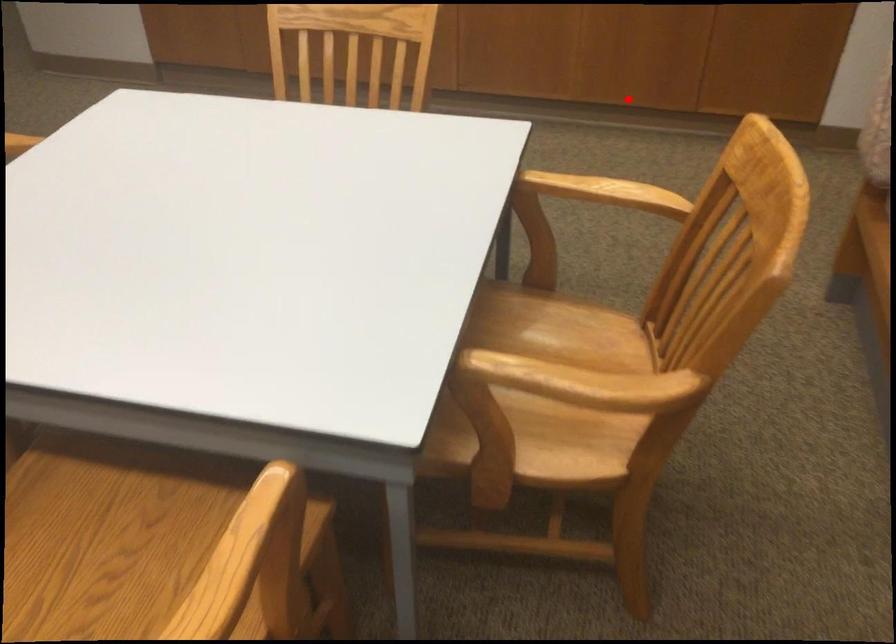
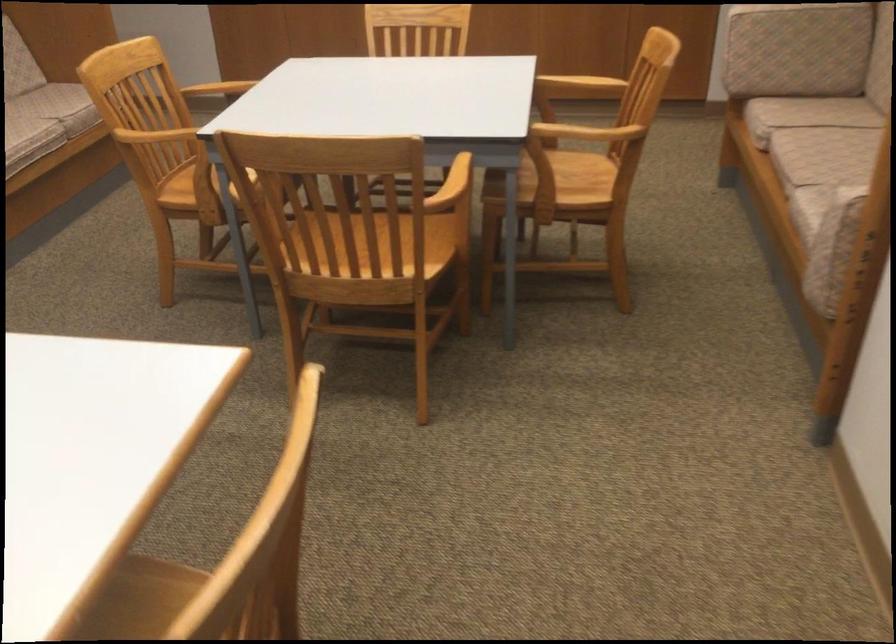
Question: A red point is marked in image1. In image2, is the corresponding 3D point closer to the camera or farther? Reply with the corresponding letter.

Choices:
 (A) The corresponding 3D point is closer.
 (B) The corresponding 3D point is farther.

Answer: (B)